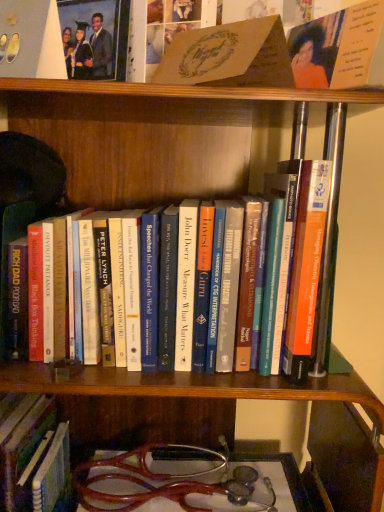
The image size is (384, 512). What are the coordinates of `unoccupied space behind matte black graduation gown at upper left` in the screenshot? It's located at (119, 116).